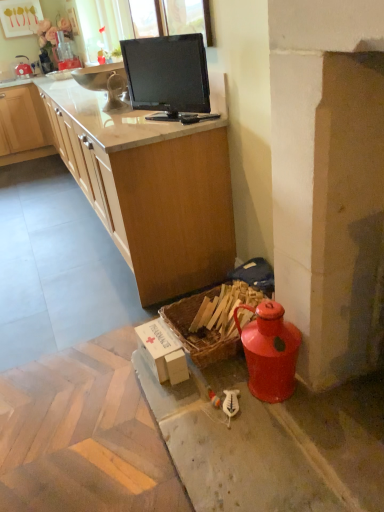
At what (x,y) coordinates should I click in order to perform the action: click on white cardboard box at lower center. Please return your answer as a coordinate pair (x, y). Looking at the image, I should click on (162, 352).

Describe the element at coordinates (138, 179) in the screenshot. I see `matte wood countertop at upper center` at that location.

Where is `white cardboard box at lower center`? This screenshot has width=384, height=512. white cardboard box at lower center is located at coordinates (162, 352).

Which of these two, white cardboard box at lower center or matte wood countertop at upper center, stands shorter?

Standing shorter between the two is white cardboard box at lower center.

From a real-world perspective, is white cardboard box at lower center over matte wood countertop at upper center?

Incorrect, from a real-world perspective, white cardboard box at lower center is lower than matte wood countertop at upper center.

Considering the relative sizes of white cardboard box at lower center and matte wood countertop at upper center in the image provided, is white cardboard box at lower center thinner than matte wood countertop at upper center?

Yes, white cardboard box at lower center is thinner than matte wood countertop at upper center.

From the image's perspective, is white cardboard box at lower center above or below matte wood countertop at upper center?

white cardboard box at lower center is below matte wood countertop at upper center.

Considering the relative sizes of woven wood picnic basket at lower right and matte wood countertop at upper center in the image provided, is woven wood picnic basket at lower right taller than matte wood countertop at upper center?

No.

Which of these two, woven wood picnic basket at lower right or matte wood countertop at upper center, is thinner?

Thinner between the two is woven wood picnic basket at lower right.

Are woven wood picnic basket at lower right and matte wood countertop at upper center far apart?

No, woven wood picnic basket at lower right is in close proximity to matte wood countertop at upper center.

Is woven wood picnic basket at lower right aimed at matte wood countertop at upper center?

No.

Is black glossy monitor at upper center facing away from woven wood picnic basket at lower right?

That's not correct — black glossy monitor at upper center is not looking away from woven wood picnic basket at lower right.

From the image's perspective, is black glossy monitor at upper center positioned above or below woven wood picnic basket at lower right?

black glossy monitor at upper center is situated higher than woven wood picnic basket at lower right in the image.

Is black glossy monitor at upper center placed right next to woven wood picnic basket at lower right?

No, black glossy monitor at upper center is not making contact with woven wood picnic basket at lower right.

Is point (187, 99) farther from camera compared to point (191, 337)?

Yes, it is.

Is matte wood countertop at upper center beside white cardboard box at lower center?

matte wood countertop at upper center and white cardboard box at lower center are clearly separated.

From the picture: Which of these two, matte wood countertop at upper center or white cardboard box at lower center, is thinner?

With smaller width is white cardboard box at lower center.

Considering the positions of objects matte wood countertop at upper center and white cardboard box at lower center in the image provided, who is more to the left, matte wood countertop at upper center or white cardboard box at lower center?

matte wood countertop at upper center is more to the left.

Between matte wood countertop at upper center and white cardboard box at lower center, which one is positioned in front?

white cardboard box at lower center is in front.

Would you say black glossy monitor at upper center is to the left or to the right of matte wood countertop at upper center in the picture?

black glossy monitor at upper center is positioned on matte wood countertop at upper center's right side.

How many degrees apart are the facing directions of black glossy monitor at upper center and matte wood countertop at upper center?

28.2 degrees.

Does black glossy monitor at upper center have a lesser width compared to matte wood countertop at upper center?

Correct, the width of black glossy monitor at upper center is less than that of matte wood countertop at upper center.

Which point is more distant from viewer, (203, 101) or (218, 180)?

The point (218, 180) is farther from the camera.

Considering the relative positions of matte wood countertop at upper center and black glossy monitor at upper center in the image provided, is matte wood countertop at upper center to the right of black glossy monitor at upper center from the viewer's perspective?

No, matte wood countertop at upper center is not to the right of black glossy monitor at upper center.

Consider the image. Are matte wood countertop at upper center and black glossy monitor at upper center located far from each other?

No, there isn't a large distance between matte wood countertop at upper center and black glossy monitor at upper center.

Considering the relative sizes of matte wood countertop at upper center and black glossy monitor at upper center in the image provided, is matte wood countertop at upper center shorter than black glossy monitor at upper center?

No.

From the image's perspective, which is below, matte wood countertop at upper center or black glossy monitor at upper center?

black glossy monitor at upper center appears lower in the image.

Between black glossy monitor at upper center and white cardboard box at lower center, which one has smaller size?

white cardboard box at lower center.

Is black glossy monitor at upper center far away from white cardboard box at lower center?

Absolutely, black glossy monitor at upper center is distant from white cardboard box at lower center.

Which of these two, black glossy monitor at upper center or white cardboard box at lower center, is wider?

With larger width is white cardboard box at lower center.

Can you confirm if black glossy monitor at upper center is shorter than white cardboard box at lower center?

Incorrect, the height of black glossy monitor at upper center does not fall short of that of white cardboard box at lower center.

At what (x,y) coordinates should I click in order to perform the action: click on countertop on the left side of white cardboard box at lower center. Please return your answer as a coordinate pair (x, y). The height and width of the screenshot is (512, 384). Looking at the image, I should click on point(138,179).

At what (x,y) coordinates should I click in order to perform the action: click on countertop behind the woven wood picnic basket at lower right. Please return your answer as a coordinate pair (x, y). The height and width of the screenshot is (512, 384). Looking at the image, I should click on (138, 179).

Considering their positions, is white cardboard box at lower center positioned closer to black glossy monitor at upper center than matte wood countertop at upper center?

Based on the image, matte wood countertop at upper center appears to be nearer to black glossy monitor at upper center.

Looking at this image, which object lies nearer to the anchor point white cardboard box at lower center, black glossy monitor at upper center or woven wood picnic basket at lower right?

woven wood picnic basket at lower right is positioned closer to the anchor white cardboard box at lower center.

Based on their spatial positions, is black glossy monitor at upper center or white cardboard box at lower center further from matte wood countertop at upper center?

white cardboard box at lower center is further to matte wood countertop at upper center.

Considering their positions, is white cardboard box at lower center positioned further to woven wood picnic basket at lower right than black glossy monitor at upper center?

black glossy monitor at upper center is further to woven wood picnic basket at lower right.

From the image, which object appears to be nearer to black glossy monitor at upper center, matte wood countertop at upper center or woven wood picnic basket at lower right?

matte wood countertop at upper center is closer to black glossy monitor at upper center.

From the image, which object appears to be farther from white cardboard box at lower center, matte wood countertop at upper center or woven wood picnic basket at lower right?

Based on the image, matte wood countertop at upper center appears to be further to white cardboard box at lower center.

Looking at the image, which one is located further to matte wood countertop at upper center, black glossy monitor at upper center or woven wood picnic basket at lower right?

Based on the image, woven wood picnic basket at lower right appears to be further to matte wood countertop at upper center.

Considering their positions, is woven wood picnic basket at lower right positioned further to black glossy monitor at upper center than white cardboard box at lower center?

Among the two, white cardboard box at lower center is located further to black glossy monitor at upper center.

Locate an element on the screen. The width and height of the screenshot is (384, 512). television between matte wood countertop at upper center and woven wood picnic basket at lower right in the up-down direction is located at coordinates (168, 75).

You are a GUI agent. You are given a task and a screenshot of the screen. Output one action in this format:
    pyautogui.click(x=<x>, y=<y>)
    Task: Click on the picnic basket between black glossy monitor at upper center and white cardboard box at lower center from top to bottom
    This screenshot has width=384, height=512.
    Given the screenshot: What is the action you would take?
    pyautogui.click(x=210, y=321)

Where is `television between matte wood countertop at upper center and white cardboard box at lower center in the up-down direction`? The height and width of the screenshot is (512, 384). television between matte wood countertop at upper center and white cardboard box at lower center in the up-down direction is located at coordinates (168, 75).

Where is `picnic basket between matte wood countertop at upper center and white cardboard box at lower center in the up-down direction`? picnic basket between matte wood countertop at upper center and white cardboard box at lower center in the up-down direction is located at coordinates (210, 321).